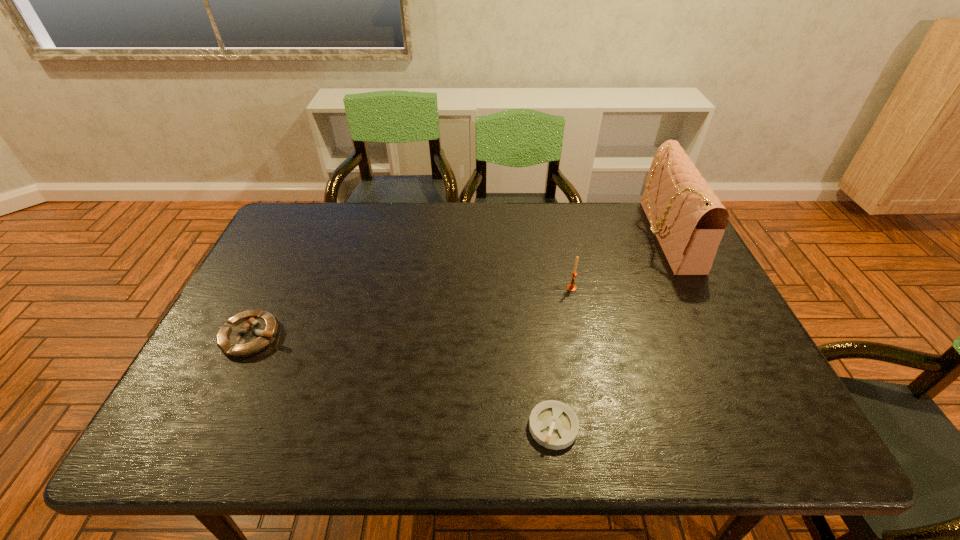
You are a GUI agent. You are given a task and a screenshot of the screen. Output one action in this format:
    pyautogui.click(x=<x>, y=<y>)
    Task: Click on the unoccupied area between the shorter ashtray and the candle_holder
    The image size is (960, 540).
    Given the screenshot: What is the action you would take?
    coord(563,357)

The width and height of the screenshot is (960, 540). Identify the location of free area in between the handbag and the candle_holder. (618, 262).

Locate an element on the screen. The image size is (960, 540). vacant area that lies between the taller ashtray and the third shortest object is located at coordinates (412, 312).

The height and width of the screenshot is (540, 960). Identify the location of unoccupied area between the taller ashtray and the rightmost object. (459, 286).

At what (x,y) coordinates should I click in order to perform the action: click on object that is the closest to the handbag. Please return your answer as a coordinate pair (x, y). Looking at the image, I should click on (571, 287).

The image size is (960, 540). I want to click on the closest object relative to the taller ashtray, so click(553, 424).

The image size is (960, 540). I want to click on vacant space that satisfies the following two spatial constraints: 1. on the back side of the third nearest object; 2. on the left side of the farther ashtray, so click(x=276, y=288).

Find the location of a particular element. free location that satisfies the following two spatial constraints: 1. on the front-facing side of the rightmost object; 2. on the front side of the third object from left to right is located at coordinates (691, 288).

Locate an element on the screen. vacant position in the image that satisfies the following two spatial constraints: 1. on the front-facing side of the farthest object; 2. on the front side of the second object from left to right is located at coordinates (760, 427).